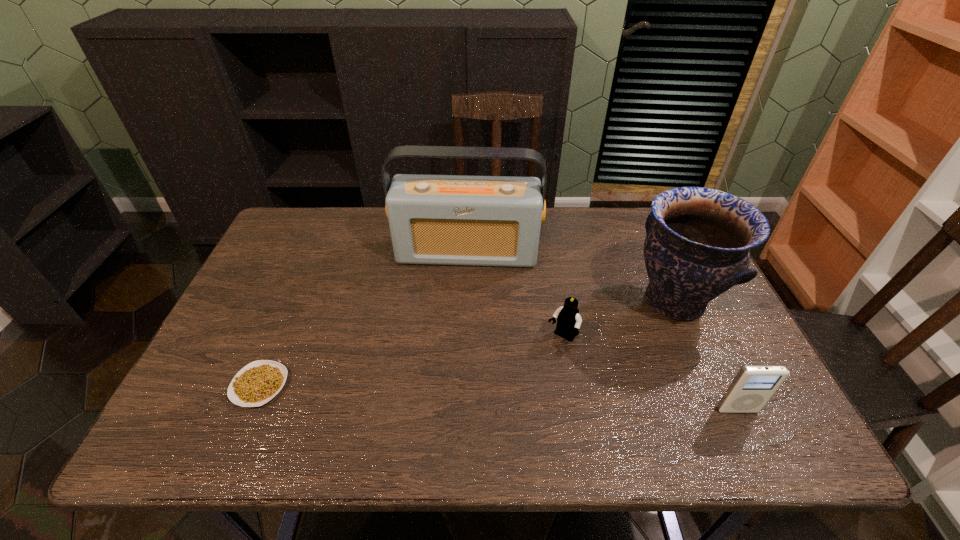
The image size is (960, 540). I want to click on vacant area located on the front-facing side of the fourth tallest object, so click(x=539, y=369).

The image size is (960, 540). I want to click on vacant space located on the front-facing side of the fourth tallest object, so click(534, 375).

Identify the location of blank space located 0.060m on the front-facing side of the fourth tallest object. This screenshot has width=960, height=540. (542, 363).

Where is `free space located 0.200m on the front handle of the fourth shortest object`? This screenshot has height=540, width=960. free space located 0.200m on the front handle of the fourth shortest object is located at coordinates (578, 351).

Find the location of `vacant space situated 0.250m on the front handle of the fourth shortest object`. vacant space situated 0.250m on the front handle of the fourth shortest object is located at coordinates (562, 359).

At what (x,y) coordinates should I click in order to perform the action: click on vacant area located on the front handle of the fourth shortest object. Please return your answer as a coordinate pair (x, y). The image size is (960, 540). Looking at the image, I should click on (568, 356).

This screenshot has width=960, height=540. I want to click on object that is at the far edge, so click(464, 220).

I want to click on legume that is positioned at the near edge, so click(x=258, y=382).

The height and width of the screenshot is (540, 960). Identify the location of iPod located at the near edge. (752, 387).

Locate an element on the screen. This screenshot has height=540, width=960. object that is at the left edge is located at coordinates (258, 382).